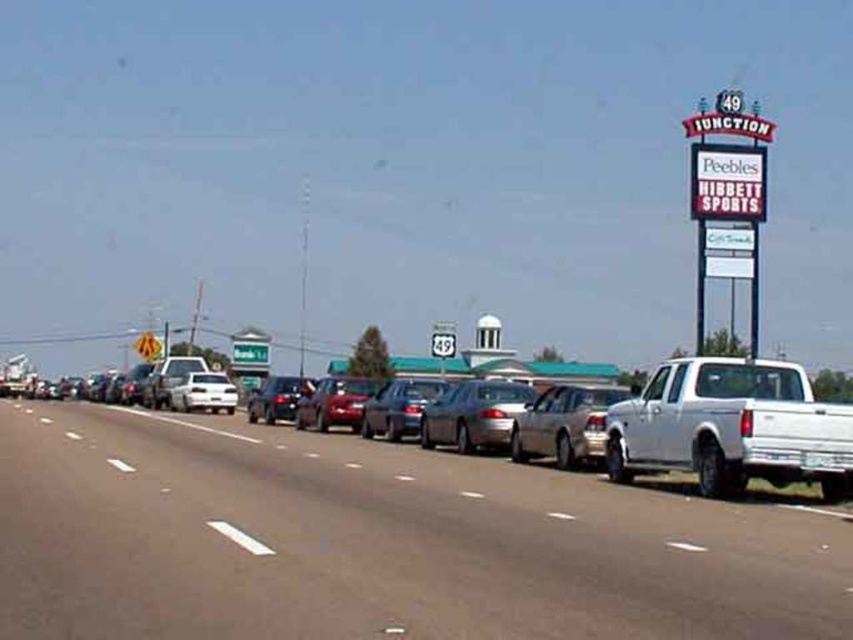
Is gray asphalt road at center thinner than shiny black sedan at center?

No.

Who is positioned more to the right, gray asphalt road at center or shiny black sedan at center?

Positioned to the right is gray asphalt road at center.

Between point (41, 547) and point (251, 410), which one is positioned behind?

Positioned behind is point (251, 410).

Image resolution: width=853 pixels, height=640 pixels. I want to click on gray asphalt road at center, so click(x=376, y=541).

Does silver metallic sedan at center appear under metallic gray sedan at center?

Correct, silver metallic sedan at center is located below metallic gray sedan at center.

Who is more distant from viewer, (555, 452) or (398, 384)?

The point (398, 384) is behind.

The image size is (853, 640). What are the coordinates of `silver metallic sedan at center` in the screenshot? It's located at (564, 424).

Is point (337, 406) positioned after point (248, 420)?

No, (337, 406) is in front of (248, 420).

Between point (318, 410) and point (306, 385), which one is positioned in front?

Positioned in front is point (318, 410).

This screenshot has height=640, width=853. Identify the location of shiny red sedan at center. (334, 403).